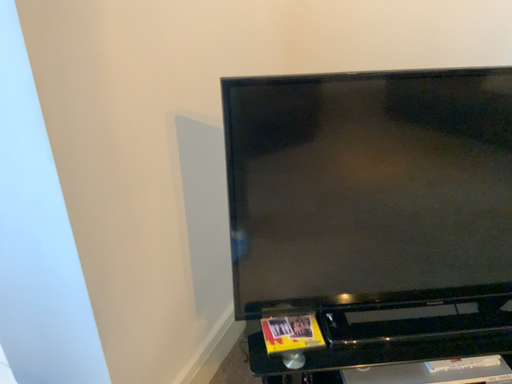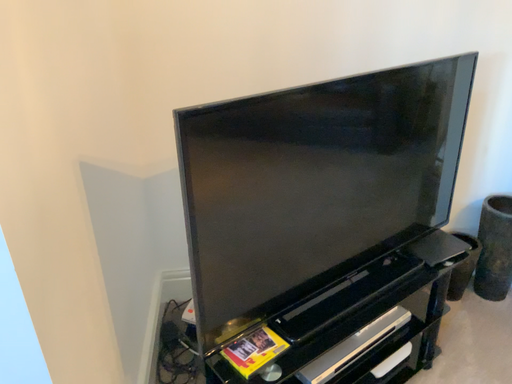
Question: Which way did the camera rotate in the video?

Choices:
 (A) rotated left
 (B) rotated right

Answer: (B)